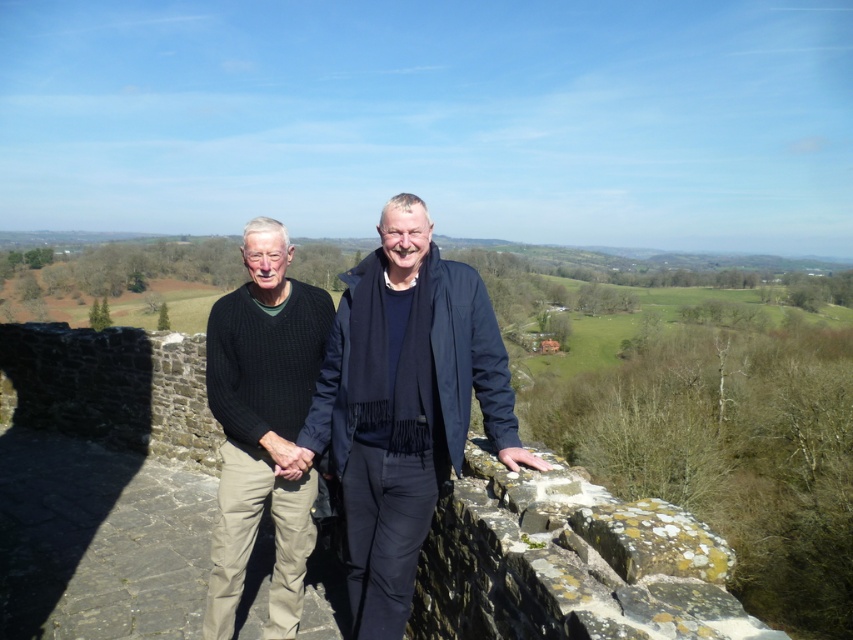
Question: Is knitted sweater at center to the left of black knitted sweater at left from the viewer's perspective?

Choices:
 (A) no
 (B) yes

Answer: (A)

Question: Can you confirm if knitted sweater at center is wider than black knitted sweater at left?

Choices:
 (A) no
 (B) yes

Answer: (A)

Question: Which object is farther from the camera taking this photo?

Choices:
 (A) knitted sweater at center
 (B) black knitted sweater at left

Answer: (B)

Question: Can you confirm if knitted sweater at center is positioned to the left of black knitted sweater at left?

Choices:
 (A) no
 (B) yes

Answer: (A)

Question: Among these objects, which one is nearest to the camera?

Choices:
 (A) knitted sweater at center
 (B) black knitted sweater at left

Answer: (A)

Question: Which of the following is the farthest from the observer?

Choices:
 (A) black knitted sweater at left
 (B) knitted sweater at center

Answer: (A)